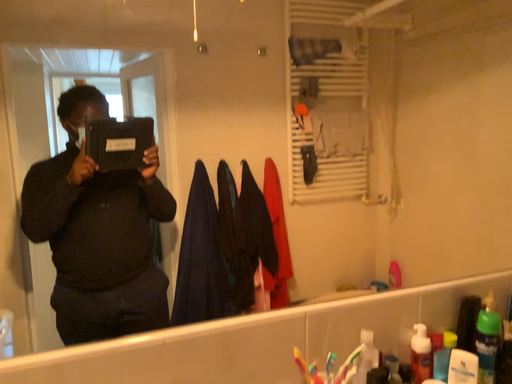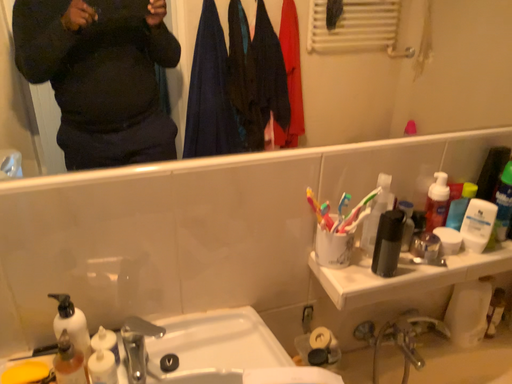
Question: How did the camera likely rotate when shooting the video?

Choices:
 (A) rotated downward
 (B) rotated upward

Answer: (A)